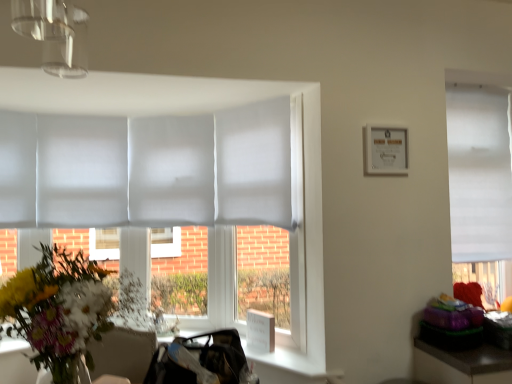
Question: From a real-world perspective, is white paper picture frame at upper right on vibrant floral bouquet at left?

Choices:
 (A) yes
 (B) no

Answer: (A)

Question: Considering the relative positions of white paper picture frame at upper right and vibrant floral bouquet at left in the image provided, is white paper picture frame at upper right in front of vibrant floral bouquet at left?

Choices:
 (A) yes
 (B) no

Answer: (B)

Question: Is white paper picture frame at upper right facing away from vibrant floral bouquet at left?

Choices:
 (A) yes
 (B) no

Answer: (B)

Question: Is white paper picture frame at upper right smaller than vibrant floral bouquet at left?

Choices:
 (A) no
 (B) yes

Answer: (B)

Question: Considering the relative positions of white paper picture frame at upper right and vibrant floral bouquet at left in the image provided, is white paper picture frame at upper right behind vibrant floral bouquet at left?

Choices:
 (A) yes
 (B) no

Answer: (A)

Question: Is vibrant floral bouquet at left bigger or smaller than white paper picture frame at upper right?

Choices:
 (A) big
 (B) small

Answer: (A)

Question: In the image, is vibrant floral bouquet at left on the left side or the right side of white paper picture frame at upper right?

Choices:
 (A) right
 (B) left

Answer: (B)

Question: From a real-world perspective, is vibrant floral bouquet at left positioned above or below white paper picture frame at upper right?

Choices:
 (A) below
 (B) above

Answer: (A)

Question: In terms of height, does vibrant floral bouquet at left look taller or shorter compared to white paper picture frame at upper right?

Choices:
 (A) short
 (B) tall

Answer: (B)

Question: From the image's perspective, relative to vibrant floral bouquet at left, is white paper picture frame at upper right above or below?

Choices:
 (A) below
 (B) above

Answer: (B)

Question: In terms of size, does white paper picture frame at upper right appear bigger or smaller than vibrant floral bouquet at left?

Choices:
 (A) big
 (B) small

Answer: (B)

Question: Considering the positions of white paper picture frame at upper right and vibrant floral bouquet at left in the image, is white paper picture frame at upper right taller or shorter than vibrant floral bouquet at left?

Choices:
 (A) tall
 (B) short

Answer: (B)

Question: Considering the relative positions of white paper picture frame at upper right and vibrant floral bouquet at left in the image provided, is white paper picture frame at upper right to the left or to the right of vibrant floral bouquet at left?

Choices:
 (A) right
 (B) left

Answer: (A)

Question: Is point (402, 135) positioned closer to the camera than point (503, 296)?

Choices:
 (A) closer
 (B) farther

Answer: (A)

Question: Is white paper picture frame at upper right in front of or behind white matte window at right in the image?

Choices:
 (A) front
 (B) behind

Answer: (A)